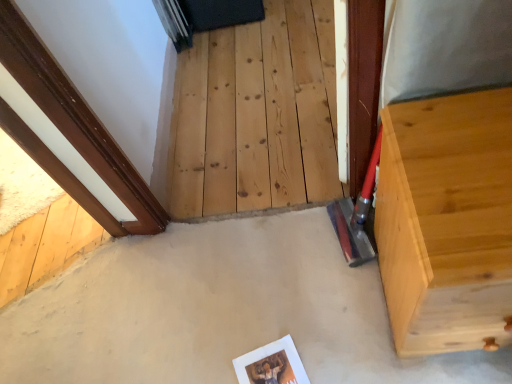
Question: Does light wood dresser at right have a lesser width compared to smooth concrete at center?

Choices:
 (A) no
 (B) yes

Answer: (B)

Question: Is light wood dresser at right smaller than smooth concrete at center?

Choices:
 (A) yes
 (B) no

Answer: (B)

Question: Could you tell me if light wood dresser at right is turned towards smooth concrete at center?

Choices:
 (A) no
 (B) yes

Answer: (A)

Question: Is light wood dresser at right wider than smooth concrete at center?

Choices:
 (A) no
 (B) yes

Answer: (A)

Question: From the image's perspective, is light wood dresser at right over smooth concrete at center?

Choices:
 (A) no
 (B) yes

Answer: (B)

Question: Is light wood dresser at right located outside smooth concrete at center?

Choices:
 (A) no
 (B) yes

Answer: (B)

Question: Can you confirm if smooth concrete at center is positioned to the right of natural wood stairwell at center?

Choices:
 (A) yes
 (B) no

Answer: (B)

Question: From a real-world perspective, does smooth concrete at center stand above natural wood stairwell at center?

Choices:
 (A) no
 (B) yes

Answer: (B)

Question: Considering the relative sizes of smooth concrete at center and natural wood stairwell at center in the image provided, is smooth concrete at center taller than natural wood stairwell at center?

Choices:
 (A) no
 (B) yes

Answer: (A)

Question: Does smooth concrete at center come in front of natural wood stairwell at center?

Choices:
 (A) yes
 (B) no

Answer: (A)

Question: Considering the relative sizes of smooth concrete at center and natural wood stairwell at center in the image provided, is smooth concrete at center thinner than natural wood stairwell at center?

Choices:
 (A) no
 (B) yes

Answer: (B)

Question: From the image's perspective, is smooth concrete at center above natural wood stairwell at center?

Choices:
 (A) no
 (B) yes

Answer: (A)

Question: Is natural wood stairwell at center placed right next to light wood dresser at right?

Choices:
 (A) yes
 (B) no

Answer: (B)